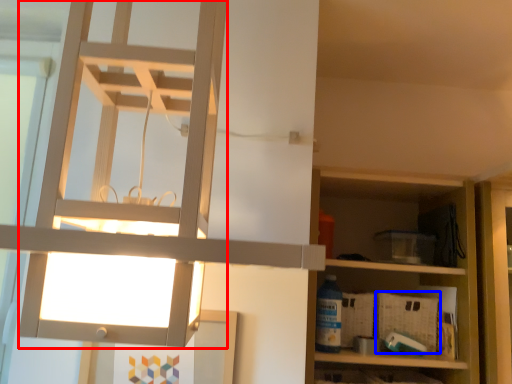
Question: Which object appears closest to the camera in this image, lamp (highlighted by a red box) or crate (highlighted by a blue box)?

Choices:
 (A) lamp
 (B) crate

Answer: (A)